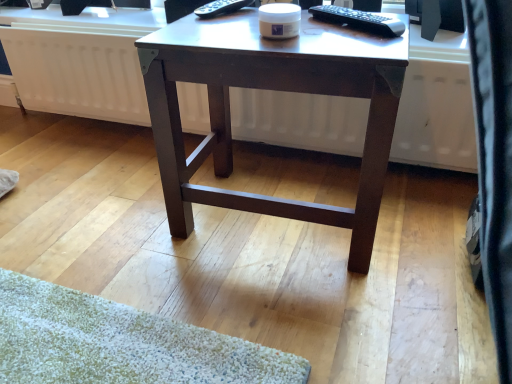
Where is `free spot below dark brown wood desk at center (from a real-world perspective)`? This screenshot has height=384, width=512. free spot below dark brown wood desk at center (from a real-world perspective) is located at coordinates (283, 217).